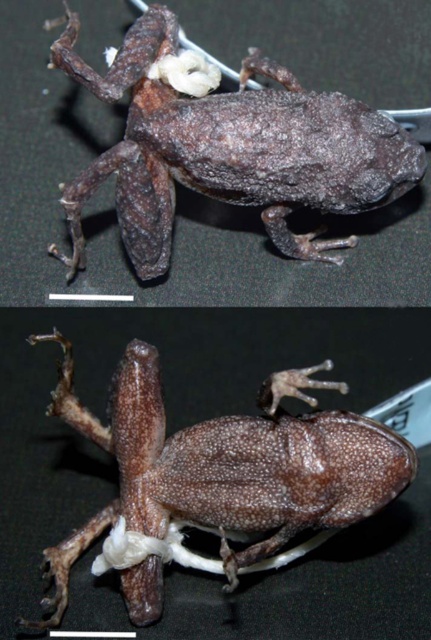
Does point (88, 182) come farther from viewer compared to point (365, 502)?

Yes, point (88, 182) is behind point (365, 502).

Describe the element at coordinates (230, 150) in the screenshot. I see `fuzzy brown frog at center` at that location.

Where is `fuzzy brown frog at center`? fuzzy brown frog at center is located at coordinates pos(230,150).